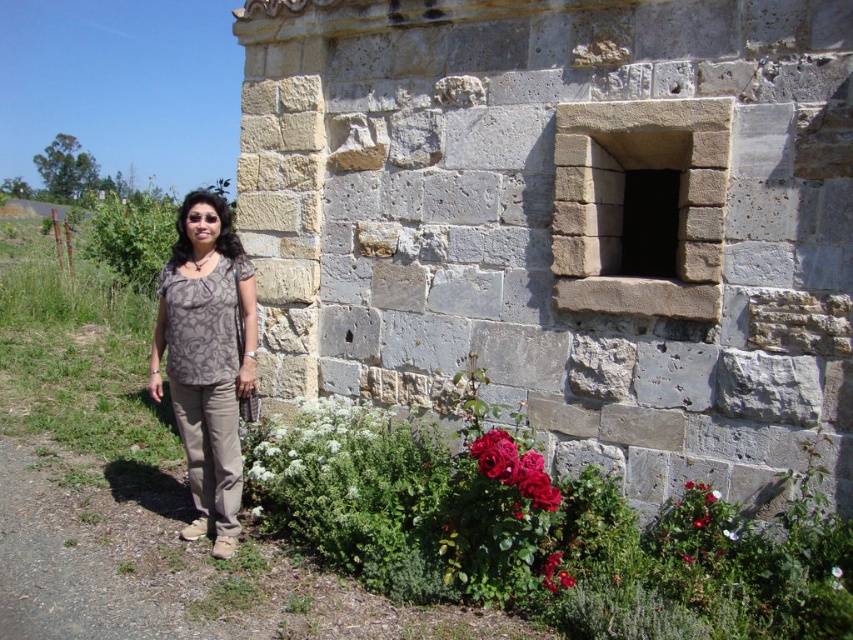
Question: Does matte brown blouse at center appear on the left side of red matte rose at lower center?

Choices:
 (A) yes
 (B) no

Answer: (A)

Question: Is gray stone window at center positioned behind vivid red petals at lower center?

Choices:
 (A) no
 (B) yes

Answer: (B)

Question: Among these points, which one is nearest to the camera?

Choices:
 (A) (786, 51)
 (B) (509, 474)

Answer: (B)

Question: Is green leafy bush at lower center above vivid red petals at lower center?

Choices:
 (A) no
 (B) yes

Answer: (A)

Question: Estimate the real-world distances between objects in this image. Which object is farther from the vivid red petals at lower center?

Choices:
 (A) gray stone window at center
 (B) green leafy bush at lower center

Answer: (A)

Question: Which of the following is the closest to the observer?

Choices:
 (A) matte brown blouse at center
 (B) vivid red petals at lower center
 (C) shiny red roses at lower center
 (D) red matte rose at lower center

Answer: (C)